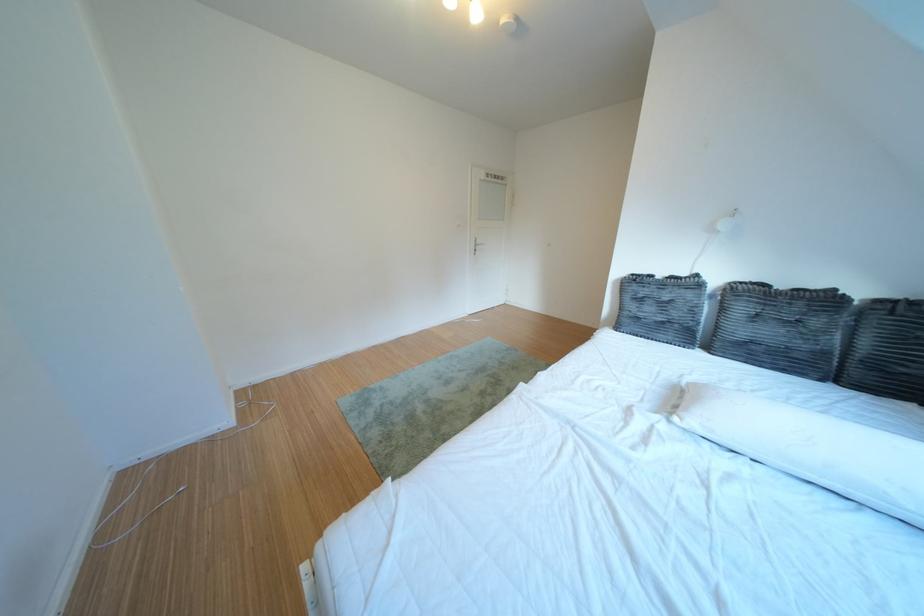
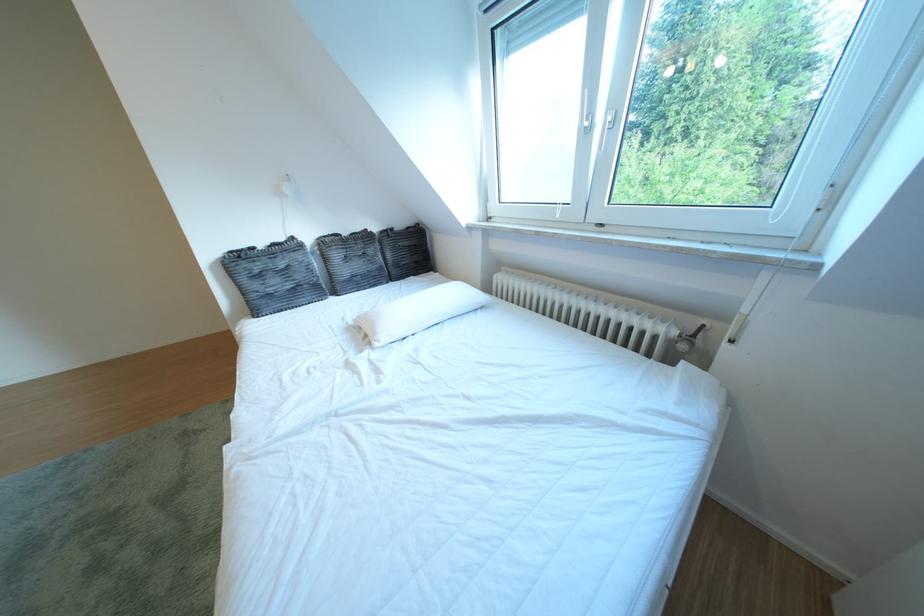
Based on the photo, the first image is from the beginning of the video and the second image is from the end. How did the camera likely rotate when shooting the video?

The rotation direction of the camera is right-down.